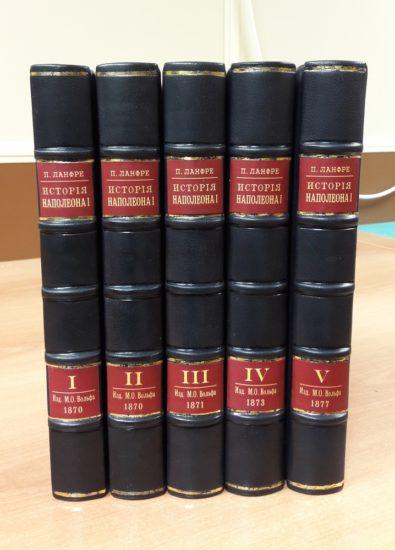
Locate an element on the screen. gold border is located at coordinates (314, 487), (252, 489), (190, 493), (141, 493), (89, 492), (62, 70), (121, 75), (198, 69), (263, 68), (332, 68).